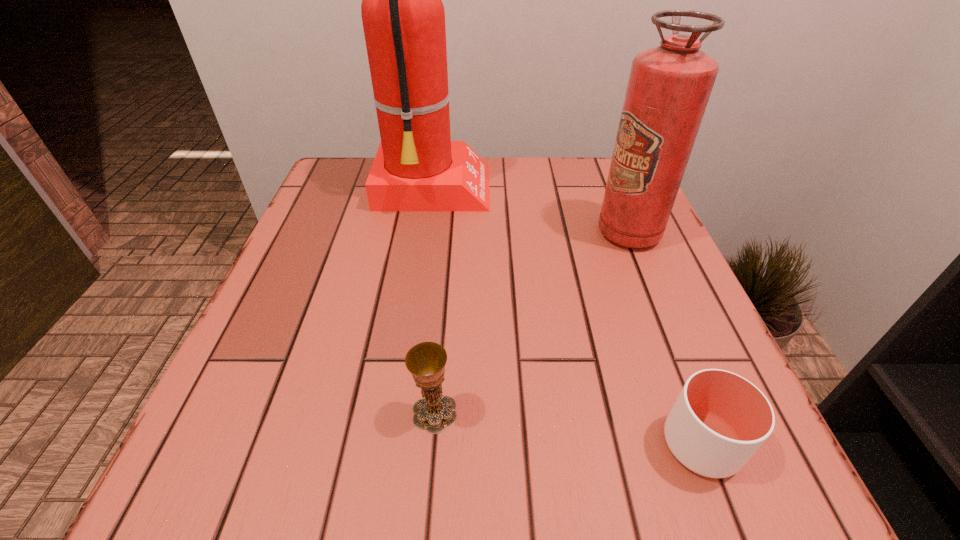
Locate an element on the screen. Image resolution: width=960 pixels, height=540 pixels. vacant area that satisfies the following two spatial constraints: 1. on the front side of the shortest object; 2. on the right side of the chalice is located at coordinates (432, 444).

You are a GUI agent. You are given a task and a screenshot of the screen. Output one action in this format:
    pyautogui.click(x=<x>, y=<y>)
    Task: Click on the free location that satisfies the following two spatial constraints: 1. on the front-facing side of the left fire extinguisher; 2. on the left side of the shortest object
    The height and width of the screenshot is (540, 960).
    Given the screenshot: What is the action you would take?
    pyautogui.click(x=396, y=444)

I want to click on vacant region that satisfies the following two spatial constraints: 1. on the front-facing side of the left fire extinguisher; 2. on the right side of the cup, so click(396, 444).

This screenshot has width=960, height=540. Find the location of `vacant position in the image that satisfies the following two spatial constraints: 1. on the front-facing side of the left fire extinguisher; 2. on the back side of the chalice`. vacant position in the image that satisfies the following two spatial constraints: 1. on the front-facing side of the left fire extinguisher; 2. on the back side of the chalice is located at coordinates (401, 412).

At what (x,y) coordinates should I click in order to perform the action: click on vacant region that satisfies the following two spatial constraints: 1. on the front-facing side of the left fire extinguisher; 2. on the back side of the second shortest object. Please return your answer as a coordinate pair (x, y). The width and height of the screenshot is (960, 540). Looking at the image, I should click on (401, 412).

Where is `free location that satisfies the following two spatial constraints: 1. on the front-facing side of the shortest object; 2. on the left side of the taller fire extinguisher`? free location that satisfies the following two spatial constraints: 1. on the front-facing side of the shortest object; 2. on the left side of the taller fire extinguisher is located at coordinates pos(396,444).